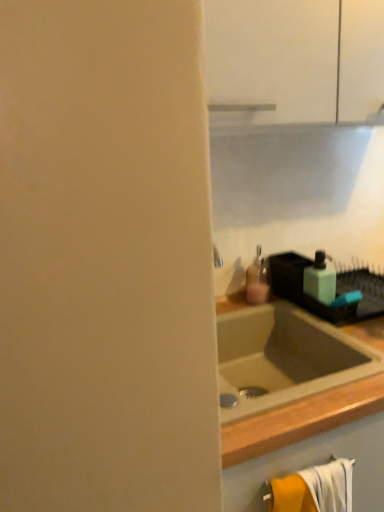
Locate an element on the screen. The width and height of the screenshot is (384, 512). green matte soap dispenser at right, which is the 1th soap dispenser from right to left is located at coordinates (320, 279).

The image size is (384, 512). Identify the location of orange cotton bath towel at lower right. (315, 489).

From a real-world perspective, is matte pink plastic soap dispenser at center, which is the 2th soap dispenser in right-to-left order, physically located above or below green matte soap dispenser at right, which is the 1th soap dispenser from right to left?

From a real-world perspective, matte pink plastic soap dispenser at center, which is the 2th soap dispenser in right-to-left order, is physically below green matte soap dispenser at right, which is the 1th soap dispenser from right to left.

Is green matte soap dispenser at right, which is the 2th soap dispenser in left-to-right order, located within matte pink plastic soap dispenser at center, which is the 2th soap dispenser in right-to-left order?

No, green matte soap dispenser at right, which is the 2th soap dispenser in left-to-right order, is not inside matte pink plastic soap dispenser at center, which is the 2th soap dispenser in right-to-left order.

From their relative heights in the image, would you say matte pink plastic soap dispenser at center, placed as the 1th soap dispenser when sorted from left to right, is taller or shorter than green matte soap dispenser at right, which is the 1th soap dispenser from right to left?

matte pink plastic soap dispenser at center, placed as the 1th soap dispenser when sorted from left to right, is taller than green matte soap dispenser at right, which is the 1th soap dispenser from right to left.

From the image's perspective, which is above, matte pink plastic soap dispenser at center, placed as the 1th soap dispenser when sorted from left to right, or green matte soap dispenser at right, which is the 2th soap dispenser in left-to-right order?

From the image's view, matte pink plastic soap dispenser at center, placed as the 1th soap dispenser when sorted from left to right, is above.

Does green matte soap dispenser at right, which is the 1th soap dispenser from right to left, touch orange cotton bath towel at lower right?

No, green matte soap dispenser at right, which is the 1th soap dispenser from right to left, is not in contact with orange cotton bath towel at lower right.

Does green matte soap dispenser at right, which is the 2th soap dispenser in left-to-right order, have a smaller size compared to orange cotton bath towel at lower right?

Yes, green matte soap dispenser at right, which is the 2th soap dispenser in left-to-right order, is smaller than orange cotton bath towel at lower right.

Would you say green matte soap dispenser at right, which is the 2th soap dispenser in left-to-right order, is inside or outside orange cotton bath towel at lower right?

green matte soap dispenser at right, which is the 2th soap dispenser in left-to-right order, lies outside orange cotton bath towel at lower right.

Is orange cotton bath towel at lower right oriented away from green matte soap dispenser at right, which is the 2th soap dispenser in left-to-right order?

No, green matte soap dispenser at right, which is the 2th soap dispenser in left-to-right order, is not at the back of orange cotton bath towel at lower right.

Does orange cotton bath towel at lower right have a larger size compared to green matte soap dispenser at right, which is the 2th soap dispenser in left-to-right order?

Correct, orange cotton bath towel at lower right is larger in size than green matte soap dispenser at right, which is the 2th soap dispenser in left-to-right order.

From the image's perspective, is orange cotton bath towel at lower right located above green matte soap dispenser at right, which is the 1th soap dispenser from right to left?

Actually, orange cotton bath towel at lower right appears below green matte soap dispenser at right, which is the 1th soap dispenser from right to left, in the image.

Is orange cotton bath towel at lower right spatially inside green matte soap dispenser at right, which is the 2th soap dispenser in left-to-right order, or outside of it?

orange cotton bath towel at lower right exists outside the volume of green matte soap dispenser at right, which is the 2th soap dispenser in left-to-right order.

Considering the sizes of objects orange cotton bath towel at lower right and matte pink plastic soap dispenser at center, placed as the 1th soap dispenser when sorted from left to right, in the image provided, who is bigger, orange cotton bath towel at lower right or matte pink plastic soap dispenser at center, placed as the 1th soap dispenser when sorted from left to right,?

With larger size is orange cotton bath towel at lower right.

At what (x,y) coordinates should I click in order to perform the action: click on bath towel below the matte pink plastic soap dispenser at center, which is the 2th soap dispenser in right-to-left order (from the image's perspective). Please return your answer as a coordinate pair (x, y). Looking at the image, I should click on (315, 489).

From a real-world perspective, is orange cotton bath towel at lower right on matte pink plastic soap dispenser at center, which is the 2th soap dispenser in right-to-left order?

No, from a real-world perspective, orange cotton bath towel at lower right is not above matte pink plastic soap dispenser at center, which is the 2th soap dispenser in right-to-left order.

From the image's perspective, does orange cotton bath towel at lower right appear higher than matte pink plastic soap dispenser at center, placed as the 1th soap dispenser when sorted from left to right?

No, from the image's perspective, orange cotton bath towel at lower right is not on top of matte pink plastic soap dispenser at center, placed as the 1th soap dispenser when sorted from left to right.

Can you confirm if matte pink plastic soap dispenser at center, which is the 2th soap dispenser in right-to-left order, is thinner than orange cotton bath towel at lower right?

No.

Is there a large distance between matte pink plastic soap dispenser at center, placed as the 1th soap dispenser when sorted from left to right, and orange cotton bath towel at lower right?

matte pink plastic soap dispenser at center, placed as the 1th soap dispenser when sorted from left to right, is near orange cotton bath towel at lower right, not far away.

Considering their positions, is matte pink plastic soap dispenser at center, which is the 2th soap dispenser in right-to-left order, located in front of or behind orange cotton bath towel at lower right?

Visually, matte pink plastic soap dispenser at center, which is the 2th soap dispenser in right-to-left order, is located behind orange cotton bath towel at lower right.

Between green matte soap dispenser at right, which is the 1th soap dispenser from right to left, and matte pink plastic soap dispenser at center, placed as the 1th soap dispenser when sorted from left to right, which one has larger size?

Bigger between the two is matte pink plastic soap dispenser at center, placed as the 1th soap dispenser when sorted from left to right.

Which object is closer to the camera, green matte soap dispenser at right, which is the 2th soap dispenser in left-to-right order, or matte pink plastic soap dispenser at center, which is the 2th soap dispenser in right-to-left order?

green matte soap dispenser at right, which is the 2th soap dispenser in left-to-right order, is more forward.

Which is in front, point (304, 278) or point (267, 300)?

Positioned in front is point (304, 278).

Where is `soap dispenser to the right of matte pink plastic soap dispenser at center, which is the 2th soap dispenser in right-to-left order`? The image size is (384, 512). soap dispenser to the right of matte pink plastic soap dispenser at center, which is the 2th soap dispenser in right-to-left order is located at coordinates (320, 279).

Locate an element on the screen. The image size is (384, 512). bath towel below the green matte soap dispenser at right, which is the 1th soap dispenser from right to left (from a real-world perspective) is located at coordinates (315, 489).

Estimate the real-world distances between objects in this image. Which object is closer to green matte soap dispenser at right, which is the 2th soap dispenser in left-to-right order, matte pink plastic soap dispenser at center, placed as the 1th soap dispenser when sorted from left to right, or orange cotton bath towel at lower right?

Based on the image, matte pink plastic soap dispenser at center, placed as the 1th soap dispenser when sorted from left to right, appears to be nearer to green matte soap dispenser at right, which is the 2th soap dispenser in left-to-right order.

Based on their spatial positions, is orange cotton bath towel at lower right or green matte soap dispenser at right, which is the 1th soap dispenser from right to left, closer to matte pink plastic soap dispenser at center, which is the 2th soap dispenser in right-to-left order?

green matte soap dispenser at right, which is the 1th soap dispenser from right to left.

Which object lies nearer to the anchor point green matte soap dispenser at right, which is the 1th soap dispenser from right to left, orange cotton bath towel at lower right or matte pink plastic soap dispenser at center, which is the 2th soap dispenser in right-to-left order?

matte pink plastic soap dispenser at center, which is the 2th soap dispenser in right-to-left order.

Based on their spatial positions, is matte pink plastic soap dispenser at center, which is the 2th soap dispenser in right-to-left order, or green matte soap dispenser at right, which is the 1th soap dispenser from right to left, closer to orange cotton bath towel at lower right?

Among the two, green matte soap dispenser at right, which is the 1th soap dispenser from right to left, is located nearer to orange cotton bath towel at lower right.

Based on their spatial positions, is green matte soap dispenser at right, which is the 1th soap dispenser from right to left, or orange cotton bath towel at lower right closer to matte pink plastic soap dispenser at center, which is the 2th soap dispenser in right-to-left order?

The object closer to matte pink plastic soap dispenser at center, which is the 2th soap dispenser in right-to-left order, is green matte soap dispenser at right, which is the 1th soap dispenser from right to left.

Which object lies further to the anchor point orange cotton bath towel at lower right, green matte soap dispenser at right, which is the 1th soap dispenser from right to left, or matte pink plastic soap dispenser at center, which is the 2th soap dispenser in right-to-left order?

matte pink plastic soap dispenser at center, which is the 2th soap dispenser in right-to-left order, is positioned further to the anchor orange cotton bath towel at lower right.

I want to click on soap dispenser between matte pink plastic soap dispenser at center, which is the 2th soap dispenser in right-to-left order, and orange cotton bath towel at lower right, in the vertical direction, so click(320, 279).